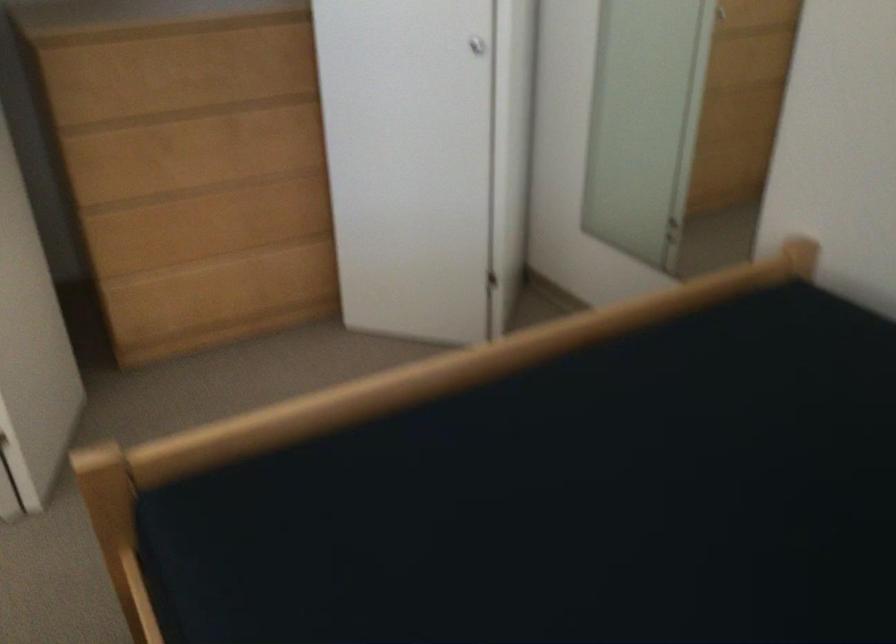
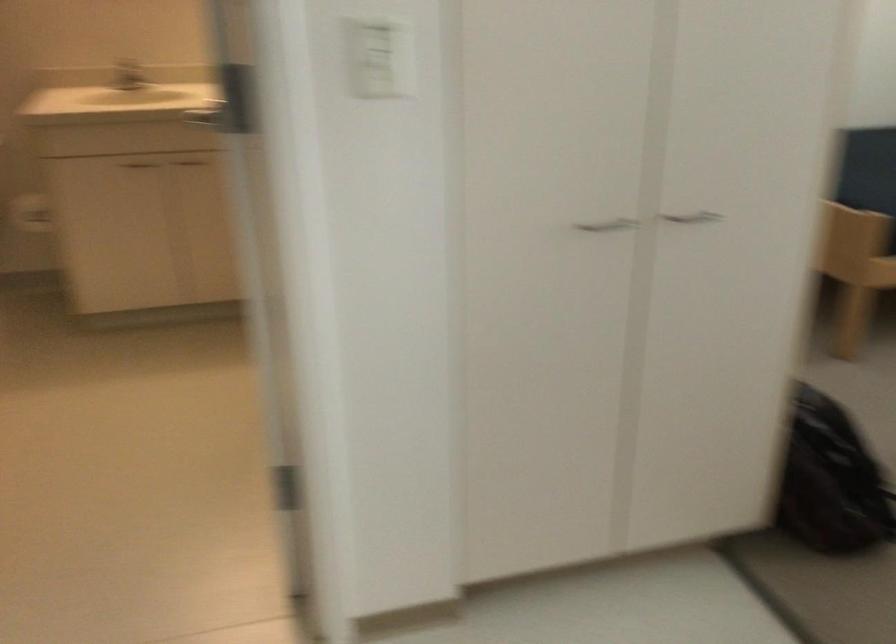
Question: I am providing you with two images of the same scene from different viewpoints. Which of the following objects are not visible in image2?

Choices:
 (A) chair sitting surface
 (B) white light switch
 (C) silver cabinet handle
 (D) none of these

Answer: (D)